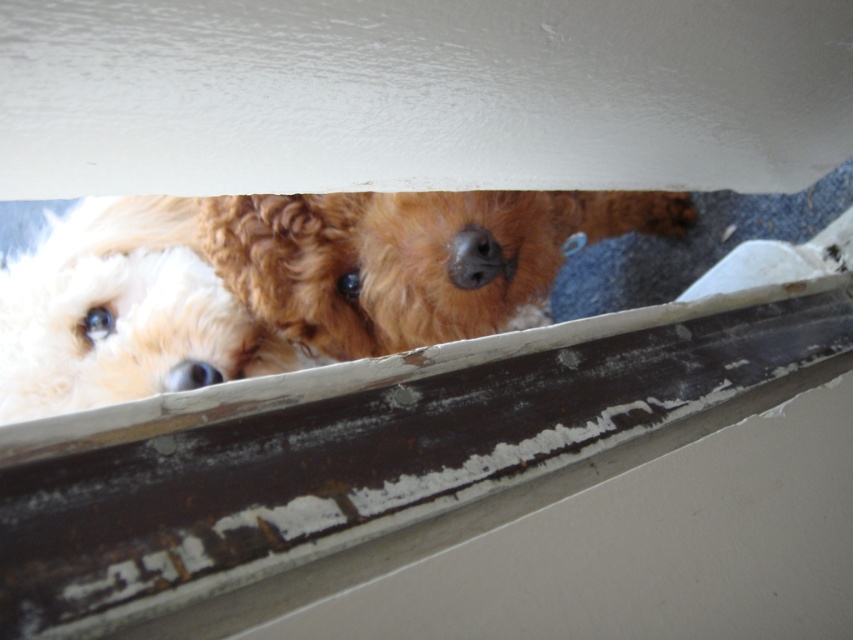
You are a painter who needs to place a ladder exactly at the position of the rusty metal window sill at lower center. What coordinates should you mark on your blueprint to ensure the ladder is placed correctly?

The coordinates for the rusty metal window sill at lower center are at point (369, 458), so you should mark those coordinates on your blueprint to place the ladder correctly.

You are a cat trying to sneak past the rusty metal window sill at lower center and the curly golden fur at center. Which object is closer to the ground?

The rusty metal window sill at lower center is positioned under curly golden fur at center, so the rusty metal window sill at lower center is closer to the ground.